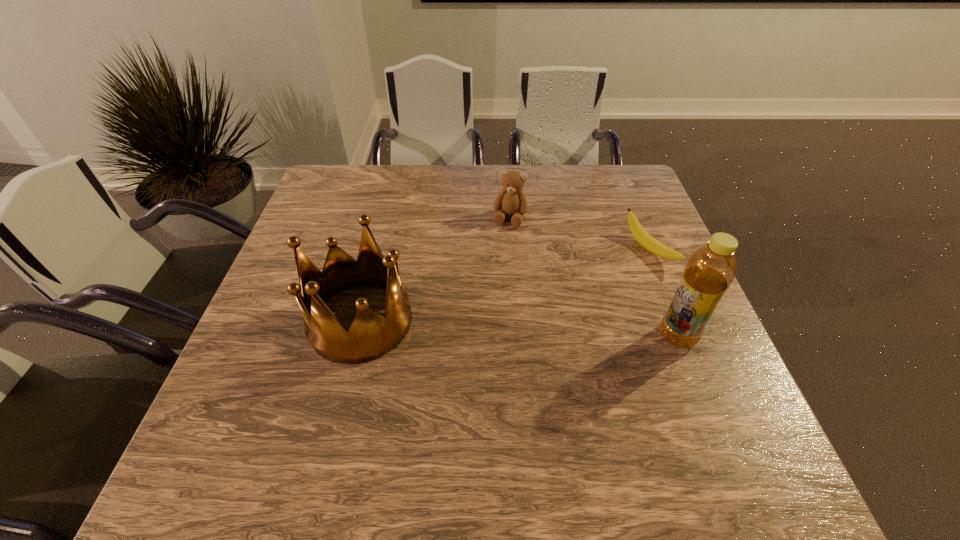
Identify the location of the leftmost object. [x=371, y=335].

The height and width of the screenshot is (540, 960). Find the location of `the second tallest object`. the second tallest object is located at coordinates (371, 335).

You are a GUI agent. You are given a task and a screenshot of the screen. Output one action in this format:
    pyautogui.click(x=<x>, y=<y>)
    Task: Click on the bottle
    
    Given the screenshot: What is the action you would take?
    pyautogui.click(x=710, y=270)

Identify the location of the third tallest object. Image resolution: width=960 pixels, height=540 pixels. (511, 200).

Where is `the third object from right to left`? the third object from right to left is located at coordinates (511, 200).

Find the location of a particular element. The width and height of the screenshot is (960, 540). the shortest object is located at coordinates (642, 237).

Identify the location of vacant area located on the right of the third shortest object. Image resolution: width=960 pixels, height=540 pixels. (575, 321).

Find the location of a particular element. Image resolution: width=960 pixels, height=540 pixels. vacant space located 0.280m on the left of the bottle is located at coordinates (531, 336).

Where is `vacant region located 0.060m on the front-facing side of the teddy bear`? vacant region located 0.060m on the front-facing side of the teddy bear is located at coordinates (503, 243).

What are the coordinates of `vacant region located 0.250m on the front-facing side of the teddy bear` in the screenshot? It's located at point(489,293).